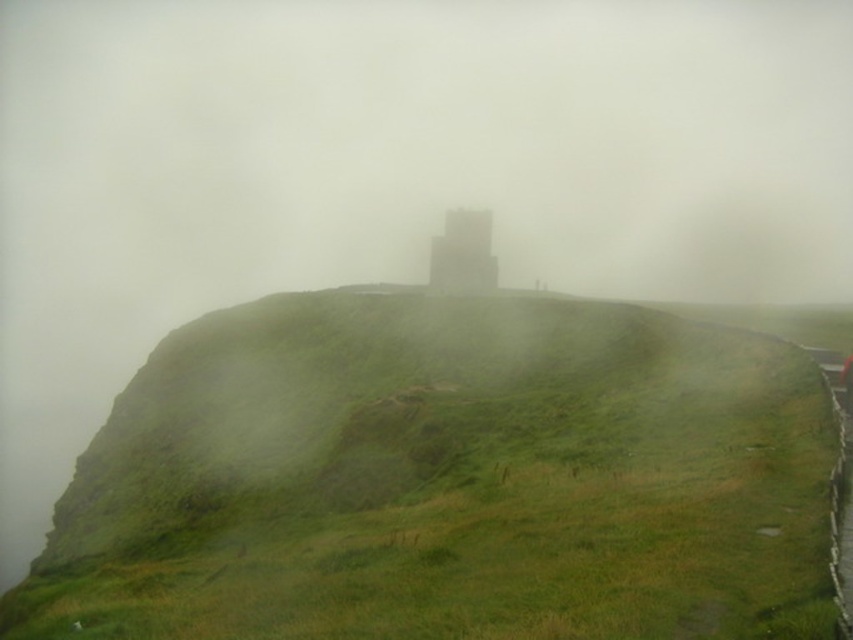
You are standing at point (445, 480) on a misty landscape. What do you see directly beneath your feet?

You are standing on the green grassy hillside at center, which is located at point (445, 480).

You are standing at the bottom of the hill and see the green grassy hillside at center and the gray concrete tower at center. Which object is closer to your left side?

The green grassy hillside at center is positioned on the left side of gray concrete tower at center, so it is closer to your left side.